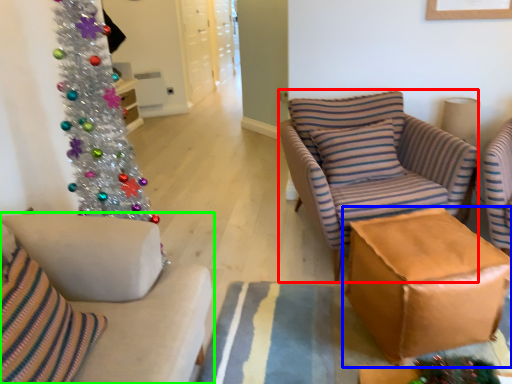
Question: Which object is the closest to the rocking chair (highlighted by a red box)? Choose among these: table (highlighted by a blue box) or studio couch (highlighted by a green box).

Choices:
 (A) table
 (B) studio couch

Answer: (A)